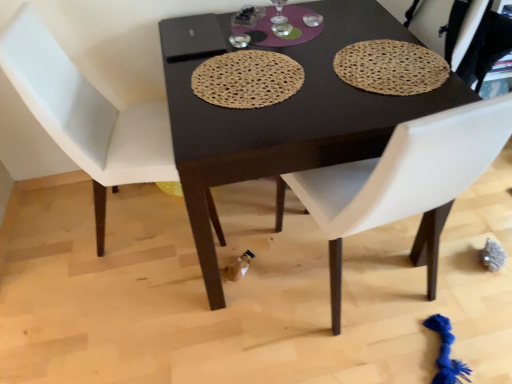
The image size is (512, 384). I want to click on blank space to the left of white leather chair at left, arranged as the 1th chair when viewed from the left, so coord(51,235).